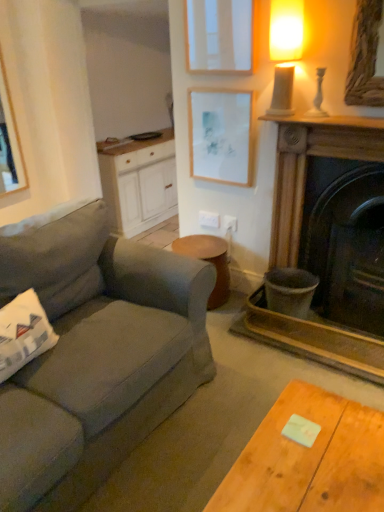
Question: Is dark brown wood fireplace at right not close to white wood cabinet at center?

Choices:
 (A) no
 (B) yes

Answer: (B)

Question: Considering the relative sizes of dark brown wood fireplace at right and white wood cabinet at center in the image provided, is dark brown wood fireplace at right shorter than white wood cabinet at center?

Choices:
 (A) no
 (B) yes

Answer: (A)

Question: From the image's perspective, would you say dark brown wood fireplace at right is positioned over white wood cabinet at center?

Choices:
 (A) no
 (B) yes

Answer: (A)

Question: Is dark brown wood fireplace at right completely or partially outside of white wood cabinet at center?

Choices:
 (A) no
 (B) yes

Answer: (B)

Question: Is dark brown wood fireplace at right taller than white wood cabinet at center?

Choices:
 (A) no
 (B) yes

Answer: (B)

Question: From a real-world perspective, is dark brown wood fireplace at right on top of white wood cabinet at center?

Choices:
 (A) yes
 (B) no

Answer: (A)

Question: Considering the relative positions of wooden stool at center and white plastic power outlet at center, the second power outlet in the left-to-right sequence, in the image provided, is wooden stool at center to the left of white plastic power outlet at center, the second power outlet in the left-to-right sequence, from the viewer's perspective?

Choices:
 (A) no
 (B) yes

Answer: (B)

Question: Does wooden stool at center come in front of white plastic power outlet at center, marked as the first power outlet in a right-to-left arrangement?

Choices:
 (A) no
 (B) yes

Answer: (B)

Question: Can you confirm if wooden stool at center is wider than white plastic power outlet at center, the second power outlet in the left-to-right sequence?

Choices:
 (A) yes
 (B) no

Answer: (A)

Question: Is wooden stool at center oriented towards white plastic power outlet at center, the second power outlet in the left-to-right sequence?

Choices:
 (A) no
 (B) yes

Answer: (A)

Question: Does wooden stool at center have a lesser width compared to white plastic power outlet at center, marked as the first power outlet in a right-to-left arrangement?

Choices:
 (A) no
 (B) yes

Answer: (A)

Question: From the image's perspective, is wooden stool at center beneath white plastic power outlet at center, marked as the first power outlet in a right-to-left arrangement?

Choices:
 (A) yes
 (B) no

Answer: (A)

Question: From a real-world perspective, does white wood cabinet at center sit lower than white plastic power outlet at center, the second power outlet in the left-to-right sequence?

Choices:
 (A) no
 (B) yes

Answer: (B)